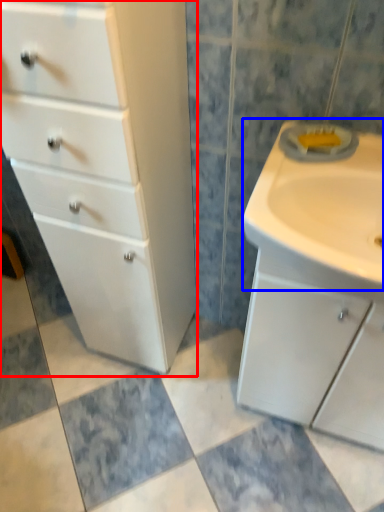
Question: Which point is further to the camera, chest of drawers (highlighted by a red box) or sink (highlighted by a blue box)?

Choices:
 (A) chest of drawers
 (B) sink

Answer: (B)